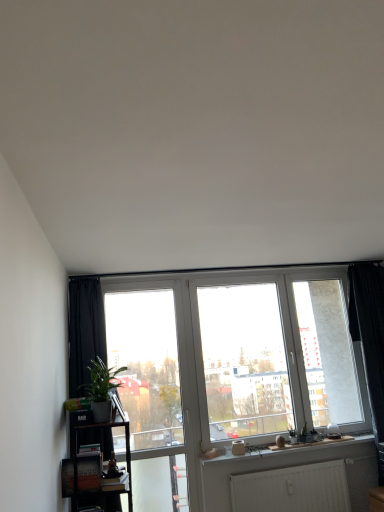
Question: Can you confirm if black wooden shelf at lower left is shorter than green leafy plant at left?

Choices:
 (A) no
 (B) yes

Answer: (A)

Question: Considering the relative sizes of black wooden shelf at lower left and green leafy plant at left in the image provided, is black wooden shelf at lower left thinner than green leafy plant at left?

Choices:
 (A) yes
 (B) no

Answer: (B)

Question: Considering the relative sizes of black wooden shelf at lower left and green leafy plant at left in the image provided, is black wooden shelf at lower left smaller than green leafy plant at left?

Choices:
 (A) yes
 (B) no

Answer: (B)

Question: Could you tell me if black wooden shelf at lower left is turned towards green leafy plant at left?

Choices:
 (A) no
 (B) yes

Answer: (A)

Question: Is black wooden shelf at lower left located outside green leafy plant at left?

Choices:
 (A) yes
 (B) no

Answer: (A)

Question: From the image's perspective, is black wooden shelf at lower left over green leafy plant at left?

Choices:
 (A) no
 (B) yes

Answer: (A)

Question: From a real-world perspective, is black wooden shelf at lower left physically above transparent glass screen door at center?

Choices:
 (A) no
 (B) yes

Answer: (A)

Question: From the image's perspective, is black wooden shelf at lower left above transparent glass screen door at center?

Choices:
 (A) yes
 (B) no

Answer: (B)

Question: Is black wooden shelf at lower left not inside transparent glass screen door at center?

Choices:
 (A) yes
 (B) no

Answer: (A)

Question: Is transparent glass screen door at center located within black wooden shelf at lower left?

Choices:
 (A) no
 (B) yes

Answer: (A)

Question: Can you confirm if black wooden shelf at lower left is bigger than transparent glass screen door at center?

Choices:
 (A) no
 (B) yes

Answer: (B)

Question: Is black wooden shelf at lower left oriented towards transparent glass screen door at center?

Choices:
 (A) yes
 (B) no

Answer: (B)

Question: From the image's perspective, does black fabric curtain at right appear lower than black wooden shelf at lower left?

Choices:
 (A) yes
 (B) no

Answer: (B)